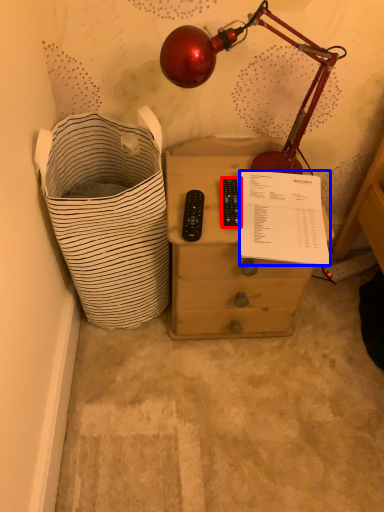
Question: Which object is closer to the camera taking this photo, control (highlighted by a red box) or writing (highlighted by a blue box)?

Choices:
 (A) control
 (B) writing

Answer: (B)